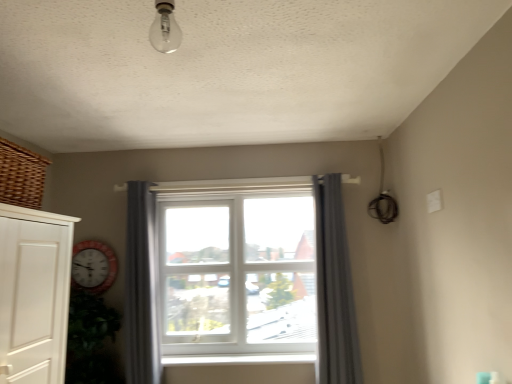
Question: From the image's perspective, is gray fabric curtain at center, arranged as the 2th curtain when viewed from the left, located beneath clear glass bulb at upper center?

Choices:
 (A) yes
 (B) no

Answer: (A)

Question: Considering the relative sizes of gray fabric curtain at center, the first curtain from the right, and clear glass bulb at upper center in the image provided, is gray fabric curtain at center, the first curtain from the right, bigger than clear glass bulb at upper center?

Choices:
 (A) no
 (B) yes

Answer: (B)

Question: Considering the relative sizes of gray fabric curtain at center, arranged as the 2th curtain when viewed from the left, and clear glass bulb at upper center in the image provided, is gray fabric curtain at center, arranged as the 2th curtain when viewed from the left, taller than clear glass bulb at upper center?

Choices:
 (A) yes
 (B) no

Answer: (A)

Question: From the image's perspective, is gray fabric curtain at center, arranged as the 2th curtain when viewed from the left, on top of clear glass bulb at upper center?

Choices:
 (A) yes
 (B) no

Answer: (B)

Question: Can you confirm if gray fabric curtain at center, the first curtain from the right, is wider than clear glass bulb at upper center?

Choices:
 (A) no
 (B) yes

Answer: (B)

Question: Is gray fabric curtain at center, arranged as the 2th curtain when viewed from the left, thinner than clear glass bulb at upper center?

Choices:
 (A) yes
 (B) no

Answer: (B)

Question: From the image's perspective, does clear glass bulb at upper center appear lower than gray fabric curtain at center, which is counted as the first curtain, starting from the left?

Choices:
 (A) yes
 (B) no

Answer: (B)

Question: Is clear glass bulb at upper center outside of gray fabric curtain at center, the second curtain positioned from the right?

Choices:
 (A) yes
 (B) no

Answer: (A)

Question: From a real-world perspective, is clear glass bulb at upper center over gray fabric curtain at center, which is counted as the first curtain, starting from the left?

Choices:
 (A) no
 (B) yes

Answer: (B)

Question: Does clear glass bulb at upper center appear on the left side of gray fabric curtain at center, the second curtain positioned from the right?

Choices:
 (A) yes
 (B) no

Answer: (B)

Question: From a real-world perspective, is clear glass bulb at upper center physically below gray fabric curtain at center, the second curtain positioned from the right?

Choices:
 (A) no
 (B) yes

Answer: (A)

Question: Is clear glass bulb at upper center taller than gray fabric curtain at center, which is counted as the first curtain, starting from the left?

Choices:
 (A) yes
 (B) no

Answer: (B)

Question: From a real-world perspective, is white wooden clock at left physically above gray fabric curtain at center, the first curtain from the right?

Choices:
 (A) yes
 (B) no

Answer: (A)